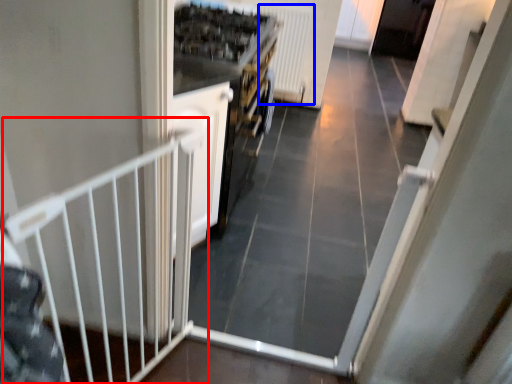
Question: Which object is closer to the camera taking this photo, rail (highlighted by a red box) or radiator (highlighted by a blue box)?

Choices:
 (A) rail
 (B) radiator

Answer: (A)